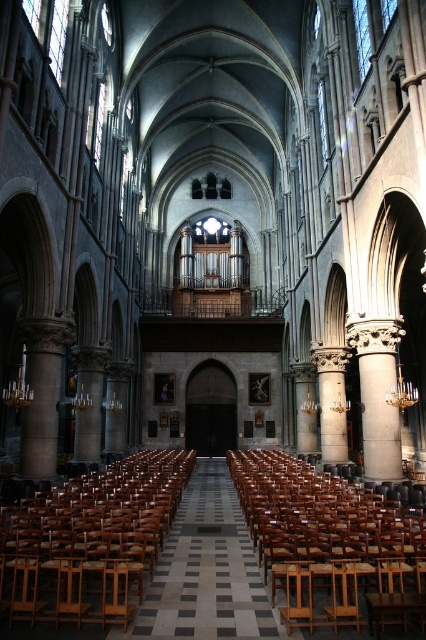
Does wooden chair at center have a larger size compared to smooth stone column at left?

Correct, wooden chair at center is larger in size than smooth stone column at left.

At what (x,y) coordinates should I click in order to perform the action: click on wooden chair at center. Please return your answer as a coordinate pair (x, y). Looking at the image, I should click on (91, 540).

Where is `wooden chair at center`? wooden chair at center is located at coordinates (91, 540).

Is point (423, 608) positioned before point (138, 497)?

Yes.

Image resolution: width=426 pixels, height=640 pixels. Describe the element at coordinates (328, 541) in the screenshot. I see `wooden polished chair at center` at that location.

At what (x,y) coordinates should I click in order to perform the action: click on wooden polished chair at center. Please return your answer as a coordinate pair (x, y). Looking at the image, I should click on (328, 541).

Measure the distance between point (293, 497) and camera.

156.81 feet

The height and width of the screenshot is (640, 426). What do you see at coordinates (328, 541) in the screenshot?
I see `wooden polished chair at center` at bounding box center [328, 541].

At what (x,y) coordinates should I click in order to perform the action: click on wooden polished chair at center. Please return your answer as a coordinate pair (x, y). The height and width of the screenshot is (640, 426). Looking at the image, I should click on point(328,541).